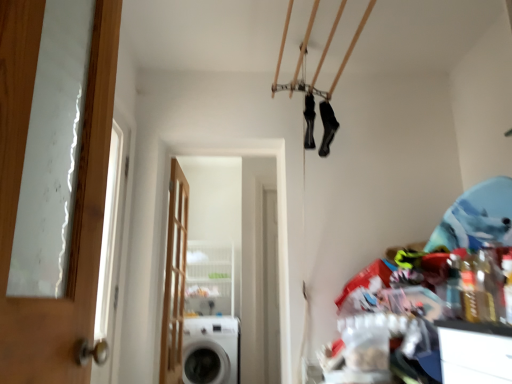
Image resolution: width=512 pixels, height=384 pixels. What do you see at coordinates (327, 127) in the screenshot? I see `black matte socks at upper center, the second shoe from the left` at bounding box center [327, 127].

What is the approximate width of white glossy screen door at center?

The width of white glossy screen door at center is 7.35 inches.

This screenshot has height=384, width=512. I want to click on wooden door at center, the second door viewed from the front, so click(174, 278).

Does white glossy screen door at center have a greater width compared to black matte socks at upper center, the second shoe from the left?

A: Yes, white glossy screen door at center is wider than black matte socks at upper center, the second shoe from the left.

Considering the positions of objects white glossy screen door at center and black matte socks at upper center, the second shoe from the left, in the image provided, who is more to the left, white glossy screen door at center or black matte socks at upper center, the second shoe from the left,?

From the viewer's perspective, white glossy screen door at center appears more on the left side.

Is point (229, 188) closer or farther from the camera than point (330, 110)?

Point (229, 188) is farther from the camera than point (330, 110).

Looking at the image, does wooden door at center, which is the second door from right to left, seem bigger or smaller compared to white glossy screen door at center?

In the image, wooden door at center, which is the second door from right to left, appears to be smaller than white glossy screen door at center.

Does wooden door at center, which is the second door from right to left, contain white glossy screen door at center?

No.

Would you say wooden door at center, which ranks as the first door in left-to-right order, is to the left or to the right of white glossy screen door at center in the picture?

From the image, it's evident that wooden door at center, which ranks as the first door in left-to-right order, is to the left of white glossy screen door at center.

Can you tell me how much wooden door at center, the 1th door from the back, and white glossy screen door at center differ in facing direction?

89.1 degrees.

In the image, is white glossy screen door at center positioned in front of or behind wooden door at left, arranged as the 2th door when viewed from the back?

In the image, white glossy screen door at center appears behind wooden door at left, arranged as the 2th door when viewed from the back.

Does white glossy screen door at center contain wooden door at left, the 1th door positioned from the right?

That's incorrect, wooden door at left, the 1th door positioned from the right, is not inside white glossy screen door at center.

Identify the location of screen door below the wooden door at left, the 1th door positioned from the right (from the image's perspective). pyautogui.click(x=237, y=230).

Is white glossy screen door at center with wooden door at left, the 1th door positioned from the right?

They are not placed beside each other.

Which of these two, white glossy screen door at center or black matte shoe at upper center, which is the 2th shoe in right-to-left order, stands shorter?

Standing shorter between the two is black matte shoe at upper center, which is the 2th shoe in right-to-left order.

Between white glossy screen door at center and black matte shoe at upper center, the 1th shoe viewed from the left, which one has larger size?

Bigger between the two is white glossy screen door at center.

From the image's perspective, is white glossy screen door at center above or below black matte shoe at upper center, the 1th shoe viewed from the left?

white glossy screen door at center is situated lower than black matte shoe at upper center, the 1th shoe viewed from the left, in the image.

Is point (247, 277) positioned behind point (315, 113)?

That is True.

In the scene shown: Which of these two, black matte socks at upper center, which ranks as the 1th shoe in right-to-left order, or wooden door at center, the 1th door from the back, is thinner?

black matte socks at upper center, which ranks as the 1th shoe in right-to-left order, is thinner.

Looking at this image, is wooden door at center, the 1th door from the back, a part of black matte socks at upper center, which ranks as the 1th shoe in right-to-left order?

No.

The height and width of the screenshot is (384, 512). Find the location of `the 2nd door below when counting from the black matte socks at upper center, which ranks as the 1th shoe in right-to-left order (from the image's perspective)`. the 2nd door below when counting from the black matte socks at upper center, which ranks as the 1th shoe in right-to-left order (from the image's perspective) is located at coordinates (174, 278).

Is white glossy washing machine at lower center to the left of white glossy screen door at center from the viewer's perspective?

Yes, white glossy washing machine at lower center is to the left of white glossy screen door at center.

Based on the photo, considering the sizes of objects white glossy washing machine at lower center and white glossy screen door at center in the image provided, who is taller, white glossy washing machine at lower center or white glossy screen door at center?

white glossy screen door at center.

From the image's perspective, is white glossy washing machine at lower center above or below white glossy screen door at center?

Based on their image positions, white glossy washing machine at lower center is located beneath white glossy screen door at center.

Is point (187, 333) farther from camera compared to point (234, 221)?

No, (187, 333) is closer to viewer.

Choose the correct answer: Is wooden door at left, marked as the second door in a left-to-right arrangement, inside white glossy screen door at center or outside it?

wooden door at left, marked as the second door in a left-to-right arrangement, is not enclosed by white glossy screen door at center.

Measure the distance between wooden door at left, the 1th door positioned from the right, and white glossy screen door at center.

A distance of 3.58 meters exists between wooden door at left, the 1th door positioned from the right, and white glossy screen door at center.

Which is behind, point (15, 198) or point (231, 189)?

The point (231, 189) is farther.

From a real-world perspective, is wooden door at left, arranged as the 2th door when viewed from the back, beneath white glossy screen door at center?

No, from a real-world perspective, wooden door at left, arranged as the 2th door when viewed from the back, is not below white glossy screen door at center.

The height and width of the screenshot is (384, 512). Find the location of `the 2nd shoe in front when counting from the white glossy screen door at center`. the 2nd shoe in front when counting from the white glossy screen door at center is located at coordinates (327, 127).

What are the coordinates of `screen door that is above the wooden door at center, which is the second door from right to left (from the image's perspective)` in the screenshot? It's located at (237, 230).

Considering their positions, is black matte socks at upper center, the second shoe from the left, positioned closer to wooden door at center, the 1th door from the back, than black matte shoe at upper center, which is the 2th shoe in right-to-left order?

The object closer to wooden door at center, the 1th door from the back, is black matte shoe at upper center, which is the 2th shoe in right-to-left order.

Looking at the image, which one is located closer to black matte shoe at upper center, the 1th shoe viewed from the left, white glossy screen door at center or white glossy washing machine at lower center?

Among the two, white glossy washing machine at lower center is located nearer to black matte shoe at upper center, the 1th shoe viewed from the left.

Based on their spatial positions, is wooden door at left, marked as the second door in a left-to-right arrangement, or white glossy washing machine at lower center further from black matte socks at upper center, which ranks as the 1th shoe in right-to-left order?

white glossy washing machine at lower center is further to black matte socks at upper center, which ranks as the 1th shoe in right-to-left order.

When comparing their distances from white glossy washing machine at lower center, does black matte socks at upper center, which ranks as the 1th shoe in right-to-left order, or black matte shoe at upper center, the 1th shoe viewed from the left, seem closer?

Based on the image, black matte socks at upper center, which ranks as the 1th shoe in right-to-left order, appears to be nearer to white glossy washing machine at lower center.

Which object lies nearer to the anchor point white glossy screen door at center, black matte socks at upper center, which ranks as the 1th shoe in right-to-left order, or black matte shoe at upper center, which is the 2th shoe in right-to-left order?

Based on the image, black matte socks at upper center, which ranks as the 1th shoe in right-to-left order, appears to be nearer to white glossy screen door at center.

From the image, which object appears to be nearer to black matte socks at upper center, the second shoe from the left, wooden door at left, marked as the second door in a left-to-right arrangement, or wooden door at center, which ranks as the first door in left-to-right order?

wooden door at center, which ranks as the first door in left-to-right order, is closer to black matte socks at upper center, the second shoe from the left.

Which object lies nearer to the anchor point black matte socks at upper center, which ranks as the 1th shoe in right-to-left order, black matte shoe at upper center, which is the 2th shoe in right-to-left order, or wooden door at left, arranged as the 2th door when viewed from the back?

black matte shoe at upper center, which is the 2th shoe in right-to-left order.

Considering their positions, is white glossy screen door at center positioned further to wooden door at center, the second door viewed from the front, than white glossy washing machine at lower center?

white glossy screen door at center is further to wooden door at center, the second door viewed from the front.

Locate an element on the screen. door located between wooden door at left, marked as the second door in a left-to-right arrangement, and white glossy washing machine at lower center in the depth direction is located at coordinates (174, 278).

Where is `shoe between black matte shoe at upper center, the 1th shoe viewed from the left, and white glossy washing machine at lower center in the up-down direction`? shoe between black matte shoe at upper center, the 1th shoe viewed from the left, and white glossy washing machine at lower center in the up-down direction is located at coordinates (327, 127).

You are a GUI agent. You are given a task and a screenshot of the screen. Output one action in this format:
    pyautogui.click(x=<x>, y=<y>)
    Task: Click on the screen door between black matte shoe at upper center, which is the 2th shoe in right-to-left order, and white glossy washing machine at lower center vertically
    The width and height of the screenshot is (512, 384).
    Given the screenshot: What is the action you would take?
    pyautogui.click(x=237, y=230)

You are a GUI agent. You are given a task and a screenshot of the screen. Output one action in this format:
    pyautogui.click(x=<x>, y=<y>)
    Task: Click on the shoe that lies between black matte shoe at upper center, which is the 2th shoe in right-to-left order, and white glossy screen door at center from top to bottom
    This screenshot has height=384, width=512.
    Given the screenshot: What is the action you would take?
    pyautogui.click(x=327, y=127)